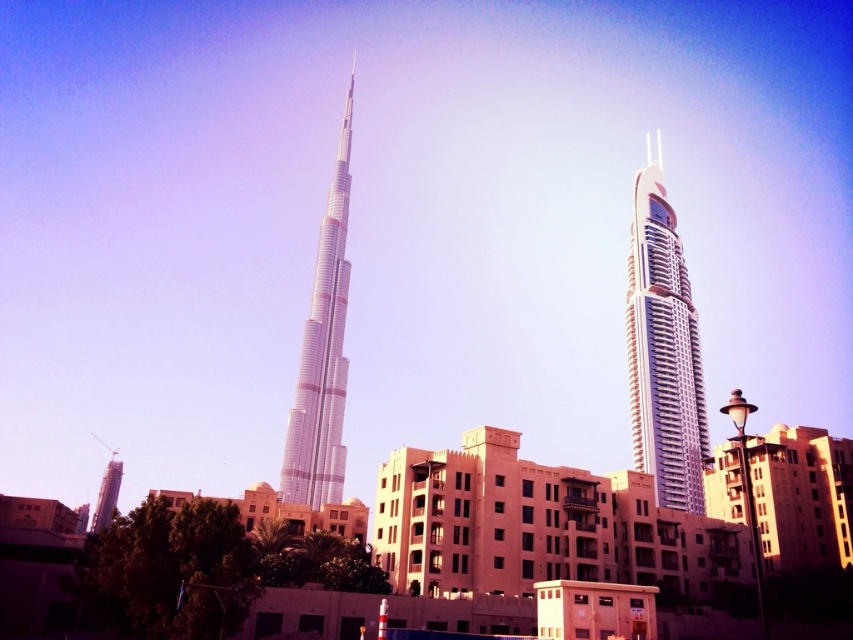
Does point (675, 448) lie behind point (306, 429)?

No.

Consider the image. Is shiny glass skyscraper at right further to camera compared to silver metallic tower at center?

No, it is not.

Does point (653, 426) come closer to viewer compared to point (334, 195)?

Yes, it is in front of point (334, 195).

At what (x,y) coordinates should I click in order to perform the action: click on shiny glass skyscraper at right. Please return your answer as a coordinate pair (x, y). This screenshot has height=640, width=853. Looking at the image, I should click on (x=663, y=348).